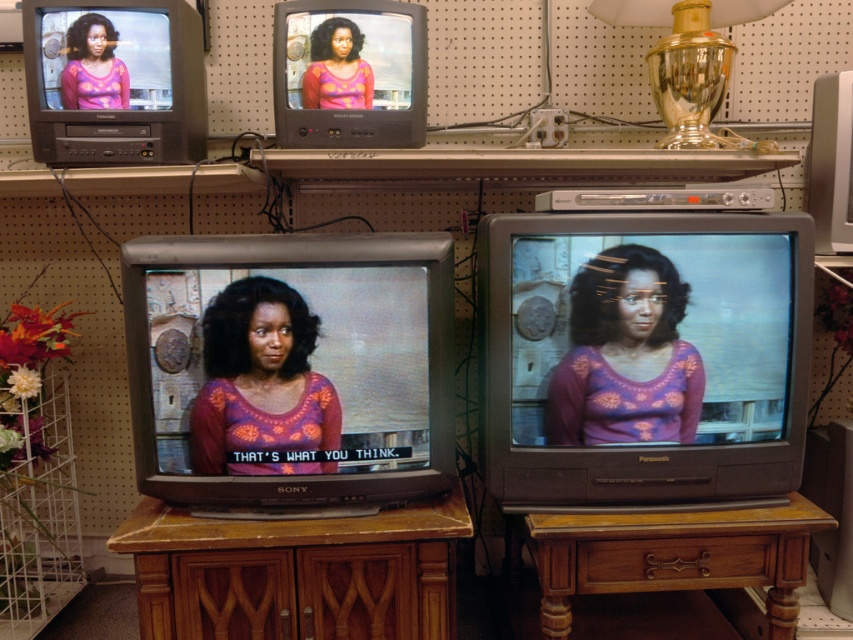
Is the position of purple floral sweater at center more distant than that of gold glass lamp at upper right?

No, purple floral sweater at center is in front of gold glass lamp at upper right.

Between purple floral sweater at center and gold glass lamp at upper right, which one has less height?

With less height is purple floral sweater at center.

Does point (302, 337) come farther from viewer compared to point (758, 12)?

No.

This screenshot has width=853, height=640. What are the coordinates of `purple floral sweater at center` in the screenshot? It's located at (260, 381).

Between matte purple sweater at upper left and matte purple blouse at center, which one is positioned lower?

Positioned lower is matte purple sweater at upper left.

Is matte purple sweater at upper left above matte purple blouse at center?

No.

Which is behind, point (74, 93) or point (303, 88)?

Point (303, 88)

Locate an element on the screen. matte purple sweater at upper left is located at coordinates (93, 67).

The width and height of the screenshot is (853, 640). Identify the location of purple floral sweater at center. (260, 381).

What do you see at coordinates (260, 381) in the screenshot? The width and height of the screenshot is (853, 640). I see `purple floral sweater at center` at bounding box center [260, 381].

Is point (334, 461) more distant than point (80, 40)?

No, (334, 461) is closer to viewer.

Where is `purple floral sweater at center`? Image resolution: width=853 pixels, height=640 pixels. purple floral sweater at center is located at coordinates click(x=260, y=381).